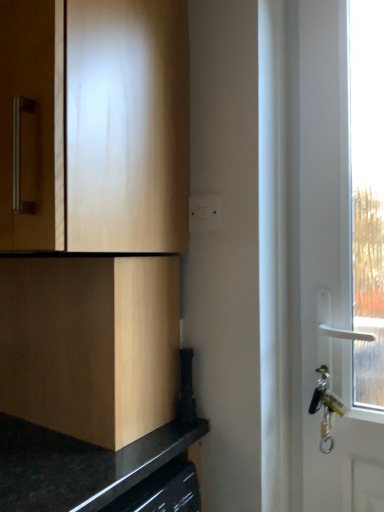
Question: Does white plastic switch at center have a greater height compared to matte wood cabinet at lower left, which is counted as the first cabinetry, starting from the bottom?

Choices:
 (A) no
 (B) yes

Answer: (A)

Question: Considering the relative sizes of white plastic switch at center and matte wood cabinet at lower left, acting as the 2th cabinetry starting from the top, in the image provided, is white plastic switch at center smaller than matte wood cabinet at lower left, acting as the 2th cabinetry starting from the top,?

Choices:
 (A) no
 (B) yes

Answer: (B)

Question: Does white plastic switch at center have a greater width compared to matte wood cabinet at lower left, acting as the 2th cabinetry starting from the top?

Choices:
 (A) yes
 (B) no

Answer: (B)

Question: Can you confirm if white plastic switch at center is positioned to the right of matte wood cabinet at lower left, which is counted as the first cabinetry, starting from the bottom?

Choices:
 (A) yes
 (B) no

Answer: (A)

Question: Is white plastic switch at center thinner than matte wood cabinet at lower left, which is counted as the first cabinetry, starting from the bottom?

Choices:
 (A) yes
 (B) no

Answer: (A)

Question: From the image's perspective, is white plastic switch at center located above or below light wood cabinet at upper left, marked as the 1th cabinetry in a top-to-bottom arrangement?

Choices:
 (A) below
 (B) above

Answer: (A)

Question: In the image, is white plastic switch at center on the left side or the right side of light wood cabinet at upper left, marked as the 1th cabinetry in a top-to-bottom arrangement?

Choices:
 (A) right
 (B) left

Answer: (A)

Question: Would you say white plastic switch at center is inside or outside light wood cabinet at upper left, marked as the 1th cabinetry in a top-to-bottom arrangement?

Choices:
 (A) outside
 (B) inside

Answer: (B)

Question: From their relative heights in the image, would you say white plastic switch at center is taller or shorter than light wood cabinet at upper left, the second cabinetry in the bottom-to-top sequence?

Choices:
 (A) short
 (B) tall

Answer: (A)

Question: In terms of height, does matte wood cabinet at lower left, acting as the 2th cabinetry starting from the top, look taller or shorter compared to white plastic switch at center?

Choices:
 (A) short
 (B) tall

Answer: (B)

Question: From the image's perspective, is matte wood cabinet at lower left, which is counted as the first cabinetry, starting from the bottom, located above or below white plastic switch at center?

Choices:
 (A) above
 (B) below

Answer: (B)

Question: Would you say matte wood cabinet at lower left, acting as the 2th cabinetry starting from the top, is to the left or to the right of white plastic switch at center in the picture?

Choices:
 (A) right
 (B) left

Answer: (B)

Question: Looking at the image, does matte wood cabinet at lower left, acting as the 2th cabinetry starting from the top, seem bigger or smaller compared to white plastic switch at center?

Choices:
 (A) small
 (B) big

Answer: (B)

Question: Is point (175, 167) positioned closer to the camera than point (210, 195)?

Choices:
 (A) closer
 (B) farther

Answer: (A)

Question: Is light wood cabinet at upper left, marked as the 1th cabinetry in a top-to-bottom arrangement, to the left or to the right of white plastic switch at center in the image?

Choices:
 (A) right
 (B) left

Answer: (B)